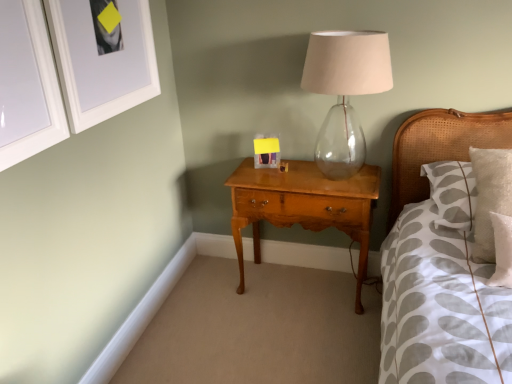
Where is `free space in front of shiny brown wood nightstand at center`? Image resolution: width=512 pixels, height=384 pixels. free space in front of shiny brown wood nightstand at center is located at coordinates (300, 339).